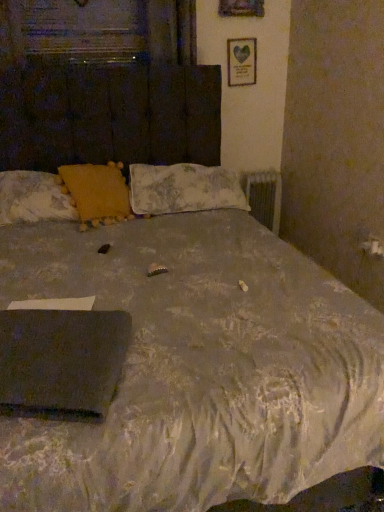
This screenshot has width=384, height=512. What are the coordinates of `metallic silver radiator at right` in the screenshot? It's located at (264, 197).

The image size is (384, 512). What do you see at coordinates (33, 198) in the screenshot?
I see `yellow fabric pillow at upper left, positioned as the first pillow in left-to-right order` at bounding box center [33, 198].

Find the location of a particular element. This screenshot has width=384, height=512. yellow fabric pillow at upper left, positioned as the first pillow in left-to-right order is located at coordinates (33, 198).

Image resolution: width=384 pixels, height=512 pixels. Describe the element at coordinates (183, 189) in the screenshot. I see `fluffy fabric pillow at center, the 3th pillow in the left-to-right sequence` at that location.

At what (x,y) coordinates should I click in order to perform the action: click on black matte laptop at lower left. Please return your answer as a coordinate pair (x, y). The width and height of the screenshot is (384, 512). Looking at the image, I should click on (61, 361).

In the image, is white paper at upper center positioned in front of or behind fluffy fabric pillow at center, the first pillow viewed from the right?

white paper at upper center is positioned farther from the viewer than fluffy fabric pillow at center, the first pillow viewed from the right.

Considering the relative sizes of white paper at upper center and fluffy fabric pillow at center, the first pillow viewed from the right, in the image provided, is white paper at upper center shorter than fluffy fabric pillow at center, the first pillow viewed from the right,?

No.

Measure the distance between white paper at upper center and fluffy fabric pillow at center, the first pillow viewed from the right.

A distance of 38.60 inches exists between white paper at upper center and fluffy fabric pillow at center, the first pillow viewed from the right.

From the picture: Is fluffy fabric pillow at center, the 3th pillow in the left-to-right sequence, a part of white paper at upper center?

Actually, fluffy fabric pillow at center, the 3th pillow in the left-to-right sequence, is outside white paper at upper center.

Find the location of a particular element. pillow that is the 1st one when counting forward from the fluffy fabric pillow at center, the first pillow viewed from the right is located at coordinates (33, 198).

Can you see fluffy fabric pillow at center, the first pillow viewed from the right, touching yellow fabric pillow at upper left, positioned as the first pillow in left-to-right order?

They are not placed beside each other.

Can yellow fabric pillow at upper left, positioned as the first pillow in left-to-right order, be found inside fluffy fabric pillow at center, the 3th pillow in the left-to-right sequence?

No, fluffy fabric pillow at center, the 3th pillow in the left-to-right sequence, does not contain yellow fabric pillow at upper left, positioned as the first pillow in left-to-right order.

Considering the relative sizes of fluffy fabric pillow at center, the 3th pillow in the left-to-right sequence, and yellow fabric pillow at upper left, positioned as the first pillow in left-to-right order, in the image provided, is fluffy fabric pillow at center, the 3th pillow in the left-to-right sequence, wider than yellow fabric pillow at upper left, positioned as the first pillow in left-to-right order,?

Yes, fluffy fabric pillow at center, the 3th pillow in the left-to-right sequence, is wider than yellow fabric pillow at upper left, positioned as the first pillow in left-to-right order.

Would you say metallic silver radiator at right is to the left or to the right of yellow fabric pillow at upper center, the second pillow positioned from the right, in the picture?

Based on their positions, metallic silver radiator at right is located to the right of yellow fabric pillow at upper center, the second pillow positioned from the right.

How far apart are metallic silver radiator at right and yellow fabric pillow at upper center, the second pillow positioned from the right?

metallic silver radiator at right and yellow fabric pillow at upper center, the second pillow positioned from the right, are 4.11 feet apart from each other.

Is metallic silver radiator at right directly adjacent to yellow fabric pillow at upper center, the second pillow when ordered from left to right?

No, metallic silver radiator at right is not making contact with yellow fabric pillow at upper center, the second pillow when ordered from left to right.

Based on the photo, how many degrees apart are the facing directions of metallic silver radiator at right and yellow fabric pillow at upper center, the second pillow positioned from the right?

The angle between the facing direction of metallic silver radiator at right and the facing direction of yellow fabric pillow at upper center, the second pillow positioned from the right, is 18.5 degrees.

From the image's perspective, is yellow fabric pillow at upper left, positioned as the first pillow in left-to-right order, located above metallic silver radiator at right?

Incorrect, from the image's perspective, yellow fabric pillow at upper left, positioned as the first pillow in left-to-right order, is lower than metallic silver radiator at right.

Is yellow fabric pillow at upper left, the 3th pillow in the right-to-left sequence, wider than metallic silver radiator at right?

Indeed, yellow fabric pillow at upper left, the 3th pillow in the right-to-left sequence, has a greater width compared to metallic silver radiator at right.

Is yellow fabric pillow at upper left, positioned as the first pillow in left-to-right order, looking in the opposite direction of metallic silver radiator at right?

No.

Is the depth of yellow fabric pillow at upper left, positioned as the first pillow in left-to-right order, greater than that of metallic silver radiator at right?

No, the depth of yellow fabric pillow at upper left, positioned as the first pillow in left-to-right order, is less than that of metallic silver radiator at right.

Considering the positions of points (275, 198) and (44, 331), is point (275, 198) closer to camera compared to point (44, 331)?

No, (275, 198) is further to viewer.

Consider the image. Is metallic silver radiator at right turned away from black matte laptop at lower left?

No, metallic silver radiator at right is not facing away from black matte laptop at lower left.

Consider the image. Considering the sizes of objects metallic silver radiator at right and black matte laptop at lower left in the image provided, who is wider, metallic silver radiator at right or black matte laptop at lower left?

black matte laptop at lower left is wider.

Is yellow fabric pillow at upper center, the second pillow positioned from the right, smaller than white paper at upper center?

Incorrect, yellow fabric pillow at upper center, the second pillow positioned from the right, is not smaller in size than white paper at upper center.

Is yellow fabric pillow at upper center, the second pillow positioned from the right, with white paper at upper center?

yellow fabric pillow at upper center, the second pillow positioned from the right, and white paper at upper center are not in contact.

Considering the positions of objects yellow fabric pillow at upper center, the second pillow positioned from the right, and white paper at upper center in the image provided, who is more to the right, yellow fabric pillow at upper center, the second pillow positioned from the right, or white paper at upper center?

From the viewer's perspective, white paper at upper center appears more on the right side.

Which of these two, yellow fabric pillow at upper center, the second pillow positioned from the right, or white paper at upper center, stands taller?

With more height is white paper at upper center.

Considering the relative sizes of white paper at upper center and yellow fabric pillow at upper center, the second pillow positioned from the right, in the image provided, is white paper at upper center taller than yellow fabric pillow at upper center, the second pillow positioned from the right,?

Correct, white paper at upper center is much taller as yellow fabric pillow at upper center, the second pillow positioned from the right.

Which object is closer to the camera taking this photo, white paper at upper center or yellow fabric pillow at upper center, the second pillow positioned from the right?

yellow fabric pillow at upper center, the second pillow positioned from the right.

Is point (250, 40) more distant than point (129, 214)?

Yes, it is behind point (129, 214).

Which object is positioned more to the left, white paper at upper center or yellow fabric pillow at upper center, the second pillow when ordered from left to right?

From the viewer's perspective, yellow fabric pillow at upper center, the second pillow when ordered from left to right, appears more on the left side.

Identify the location of the 1st pillow in front of the white paper at upper center, starting your count from the anchor. This screenshot has width=384, height=512. (183, 189).

Where is `pillow behind the yellow fabric pillow at upper left, the 3th pillow in the right-to-left sequence`? The width and height of the screenshot is (384, 512). pillow behind the yellow fabric pillow at upper left, the 3th pillow in the right-to-left sequence is located at coordinates (183, 189).

When comparing their distances from fluffy fabric pillow at center, the first pillow viewed from the right, does metallic silver radiator at right or white paper at upper center seem further?

white paper at upper center is further to fluffy fabric pillow at center, the first pillow viewed from the right.

When comparing their distances from metallic silver radiator at right, does yellow fabric pillow at upper center, the second pillow when ordered from left to right, or fluffy fabric pillow at center, the first pillow viewed from the right, seem closer?

The object closer to metallic silver radiator at right is fluffy fabric pillow at center, the first pillow viewed from the right.

Based on their spatial positions, is black matte laptop at lower left or yellow fabric pillow at upper center, the second pillow when ordered from left to right, further from fluffy fabric pillow at center, the 3th pillow in the left-to-right sequence?

black matte laptop at lower left is further to fluffy fabric pillow at center, the 3th pillow in the left-to-right sequence.

Based on their spatial positions, is yellow fabric pillow at upper left, the 3th pillow in the right-to-left sequence, or metallic silver radiator at right further from white paper at upper center?

yellow fabric pillow at upper left, the 3th pillow in the right-to-left sequence, is further to white paper at upper center.

From the image, which object appears to be farther from yellow fabric pillow at upper left, positioned as the first pillow in left-to-right order, white paper at upper center or yellow fabric pillow at upper center, the second pillow when ordered from left to right?

The object further to yellow fabric pillow at upper left, positioned as the first pillow in left-to-right order, is white paper at upper center.

Based on their spatial positions, is white paper at upper center or yellow fabric pillow at upper center, the second pillow when ordered from left to right, further from black matte laptop at lower left?

Based on the image, white paper at upper center appears to be further to black matte laptop at lower left.

Which object lies further to the anchor point metallic silver radiator at right, yellow fabric pillow at upper left, positioned as the first pillow in left-to-right order, or yellow fabric pillow at upper center, the second pillow when ordered from left to right?

yellow fabric pillow at upper left, positioned as the first pillow in left-to-right order, is positioned further to the anchor metallic silver radiator at right.

Considering their positions, is fluffy fabric pillow at center, the 3th pillow in the left-to-right sequence, positioned further to white paper at upper center than yellow fabric pillow at upper left, the 3th pillow in the right-to-left sequence?

yellow fabric pillow at upper left, the 3th pillow in the right-to-left sequence, is positioned further to the anchor white paper at upper center.

The image size is (384, 512). I want to click on pillow situated between yellow fabric pillow at upper left, positioned as the first pillow in left-to-right order, and fluffy fabric pillow at center, the first pillow viewed from the right, from left to right, so pyautogui.click(x=97, y=193).

Locate an element on the screen. The width and height of the screenshot is (384, 512). pillow between white paper at upper center and yellow fabric pillow at upper center, the second pillow when ordered from left to right, vertically is located at coordinates (183, 189).

Where is `picture frame between black matte laptop at lower left and metallic silver radiator at right from front to back`? picture frame between black matte laptop at lower left and metallic silver radiator at right from front to back is located at coordinates (241, 62).

Where is `pillow between black matte laptop at lower left and yellow fabric pillow at upper left, positioned as the first pillow in left-to-right order, from front to back`? pillow between black matte laptop at lower left and yellow fabric pillow at upper left, positioned as the first pillow in left-to-right order, from front to back is located at coordinates (97, 193).